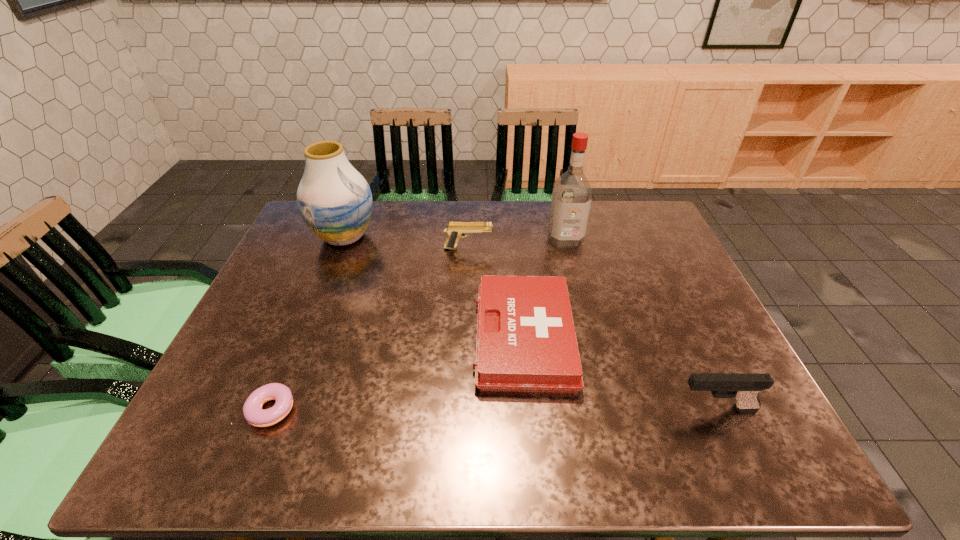
Find the location of a particular element. doughnut that is positioned at the left edge is located at coordinates (254, 414).

Locate an element on the screen. This screenshot has width=960, height=540. object present at the right edge is located at coordinates (745, 388).

You are a GUI agent. You are given a task and a screenshot of the screen. Output one action in this format:
    pyautogui.click(x=<x>, y=<y>)
    Task: Click on the object that is at the far left corner
    This screenshot has width=960, height=540.
    Given the screenshot: What is the action you would take?
    pyautogui.click(x=335, y=201)

Locate an element on the screen. object at the near left corner is located at coordinates (254, 414).

Where is `vacant space at the far edge of the desktop`? vacant space at the far edge of the desktop is located at coordinates (463, 238).

You are a GUI agent. You are given a task and a screenshot of the screen. Output one action in this format:
    pyautogui.click(x=<x>, y=<y>)
    Task: Click on the free location at the near edge
    The width and height of the screenshot is (960, 540).
    Given the screenshot: What is the action you would take?
    pyautogui.click(x=482, y=440)

The height and width of the screenshot is (540, 960). What are the coordinates of `vacant point at the left edge` in the screenshot? It's located at (269, 332).

The image size is (960, 540). Identify the location of vacant space at the right edge. (638, 279).

In order to click on vacant area at the far left corner in this screenshot , I will do `click(302, 234)`.

I want to click on vacant space at the near left corner, so click(194, 444).